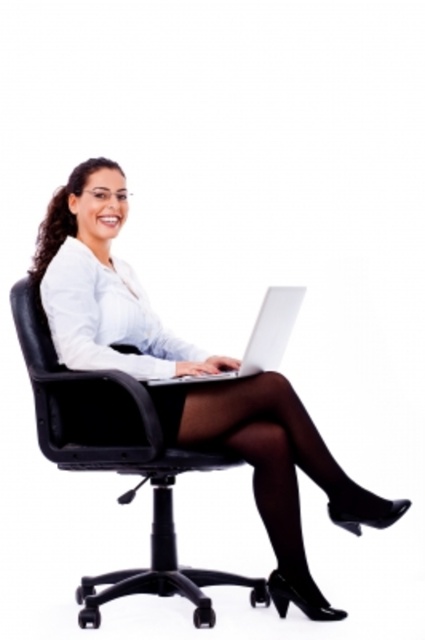
Question: Which object is closer to the camera taking this photo?

Choices:
 (A) matte black laptop at center
 (B) black leather swivel chair at center
 (C) silver metallic laptop at center

Answer: (C)

Question: Does matte black laptop at center appear on the right side of silver metallic laptop at center?

Choices:
 (A) yes
 (B) no

Answer: (B)

Question: Where is black leather swivel chair at center located in relation to silver metallic laptop at center in the image?

Choices:
 (A) below
 (B) above

Answer: (A)

Question: Which is nearer to the matte black laptop at center?

Choices:
 (A) silver metallic laptop at center
 (B) black leather swivel chair at center

Answer: (B)

Question: Can you confirm if matte black laptop at center is smaller than black leather swivel chair at center?

Choices:
 (A) no
 (B) yes

Answer: (A)

Question: Which point is closer to the camera?

Choices:
 (A) silver metallic laptop at center
 (B) black leather swivel chair at center

Answer: (A)